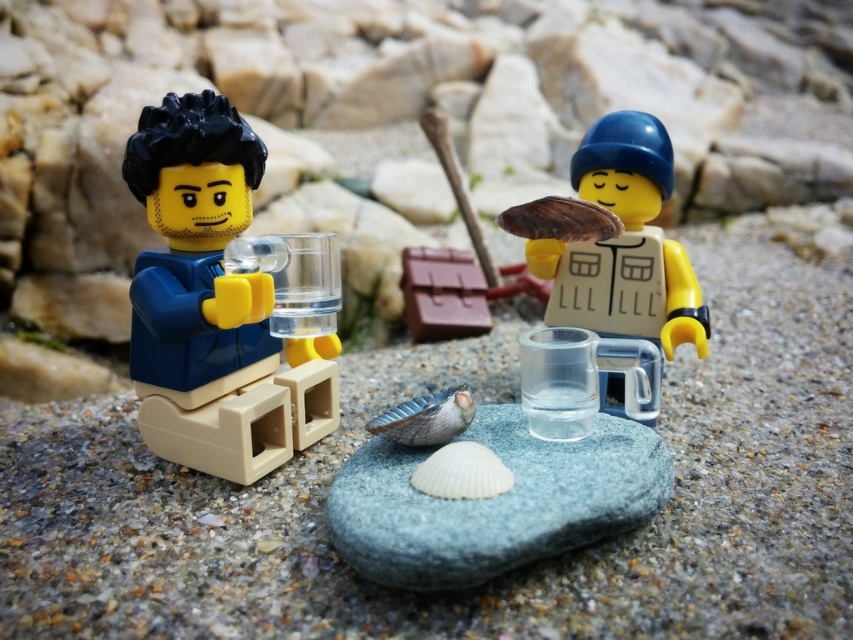
Who is shorter, smooth gray rock at center or translucent plastic mug at center?

smooth gray rock at center is shorter.

Is smooth gray rock at center to the left of translucent plastic mug at center from the viewer's perspective?

Indeed, smooth gray rock at center is positioned on the left side of translucent plastic mug at center.

What do you see at coordinates (494, 500) in the screenshot? I see `smooth gray rock at center` at bounding box center [494, 500].

Find the location of a particular element. Image resolution: width=853 pixels, height=640 pixels. smooth gray rock at center is located at coordinates (494, 500).

Can you confirm if matte blue shirt at left is wider than translucent plastic mug at center?

Correct, the width of matte blue shirt at left exceeds that of translucent plastic mug at center.

Does point (161, 353) come farther from viewer compared to point (659, 264)?

No, it is in front of (659, 264).

Find the location of a particular element. matte blue shirt at left is located at coordinates [x=213, y=304].

Locate an element on the screen. matte blue shirt at left is located at coordinates (213, 304).

Does matte blue shirt at left appear over smooth gray rock at center?

Yes, matte blue shirt at left is above smooth gray rock at center.

Is point (202, 138) positioned before point (641, 429)?

Yes, point (202, 138) is closer to viewer.

Does point (236, 179) come in front of point (566, 531)?

No, it is not.

This screenshot has height=640, width=853. What are the coordinates of `matte blue shirt at left` in the screenshot? It's located at click(213, 304).